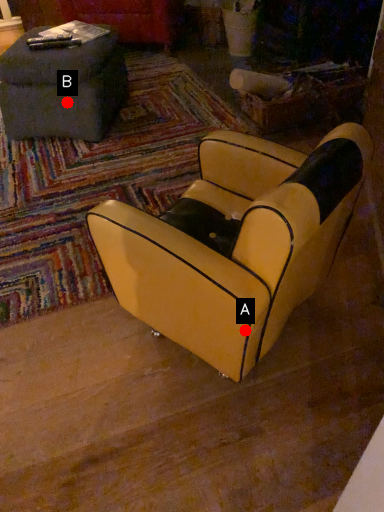
Question: Two points are circled on the image, labeled by A and B beside each circle. Which point is further to the camera?

Choices:
 (A) A is further
 (B) B is further

Answer: (B)